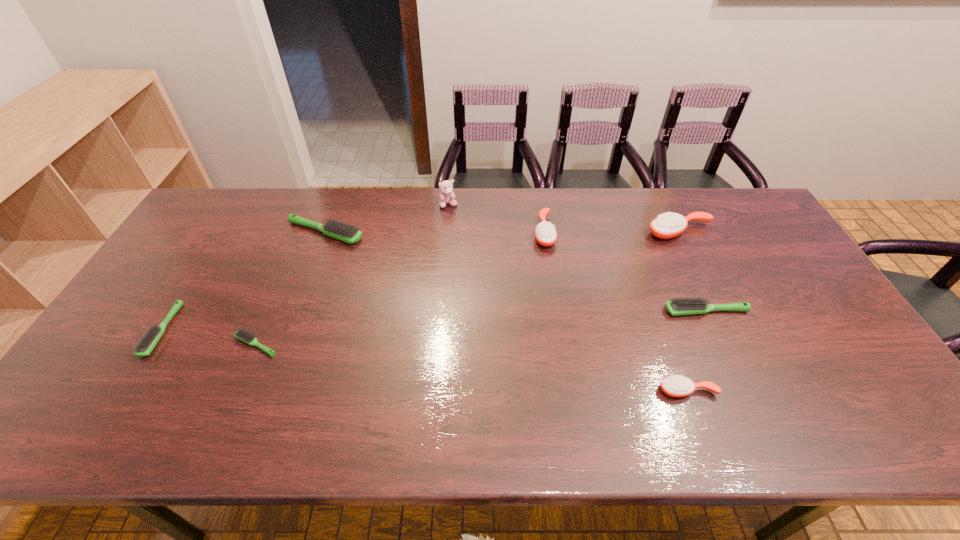
The image size is (960, 540). In order to click on teddy bear in this screenshot , I will do `click(447, 196)`.

What are the coordinates of `pink teddy bear` in the screenshot? It's located at (447, 196).

Find the location of a particular element. Image resolution: width=960 pixels, height=540 pixels. the second tallest object is located at coordinates (668, 225).

The height and width of the screenshot is (540, 960). Identify the location of the biggest orange hairbrush. [x=668, y=225].

The height and width of the screenshot is (540, 960). In order to click on the fourth hairbrush from left to right in this screenshot , I will do `click(545, 233)`.

This screenshot has width=960, height=540. I want to click on the leftmost orange hairbrush, so click(545, 233).

Locate an element on the screen. This screenshot has height=540, width=960. the biggest light hairbrush is located at coordinates (348, 233).

Locate an element on the screen. The image size is (960, 540). the second biggest light hairbrush is located at coordinates (684, 306).

Find the location of a particular element. the nearest hairbrush is located at coordinates (675, 386).

At what (x,y) coordinates should I click in order to perform the action: click on the nearest orange hairbrush. Please return your answer as a coordinate pair (x, y). The width and height of the screenshot is (960, 540). Looking at the image, I should click on (675, 386).